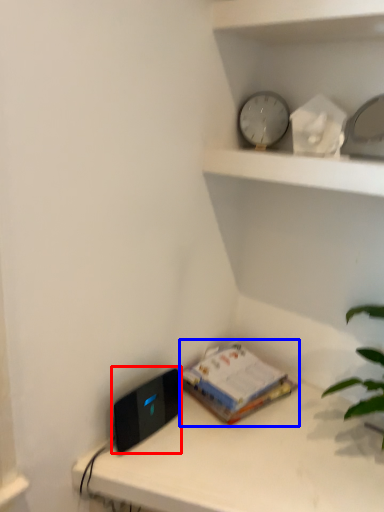
Question: Which of the following is the closest to the observer, ipod (highlighted by a red box) or paperback book (highlighted by a blue box)?

Choices:
 (A) ipod
 (B) paperback book

Answer: (A)